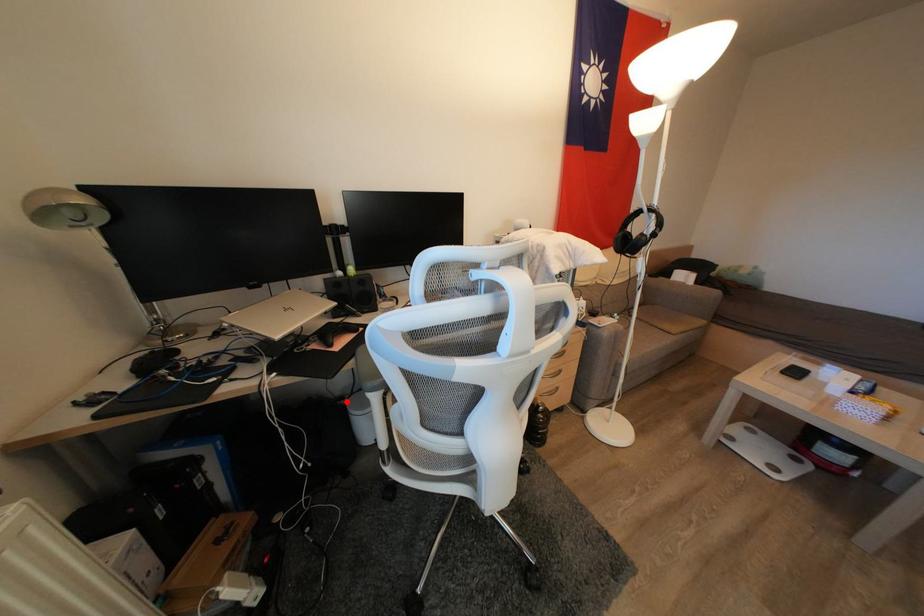
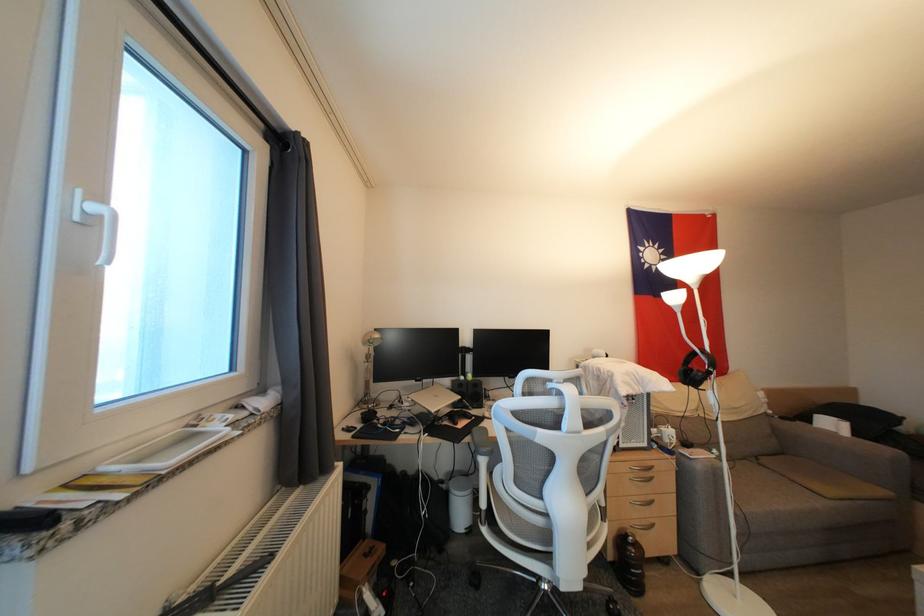
Question: I am providing you with two images of the same scene from different viewpoints. Given a red point in image1, look at the same physical point in image2. Is it:

Choices:
 (A) Closer to the viewpoint
 (B) Farther from the viewpoint

Answer: (A)